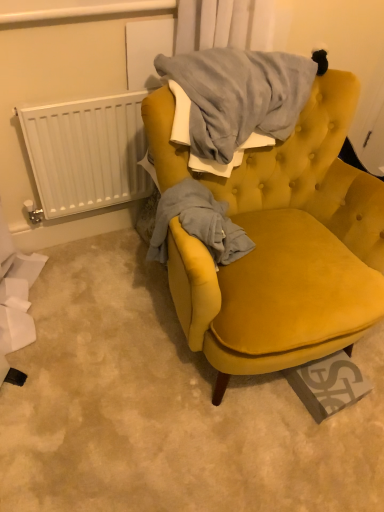
Where is `white plastic radiator at left`? Image resolution: width=384 pixels, height=512 pixels. white plastic radiator at left is located at coordinates (87, 153).

The width and height of the screenshot is (384, 512). What do you see at coordinates (87, 153) in the screenshot?
I see `white plastic radiator at left` at bounding box center [87, 153].

Measure the distance between white plastic radiator at left and camera.

white plastic radiator at left is 1.24 meters away from camera.

At what (x,y) coordinates should I click in order to perform the action: click on velvet yellow armchair at center. Please return your answer as a coordinate pair (x, y). This screenshot has width=384, height=512. Looking at the image, I should click on (288, 250).

Describe the element at coordinates (288, 250) in the screenshot. I see `velvet yellow armchair at center` at that location.

Locate an element on the screen. This screenshot has height=512, width=384. white plastic radiator at left is located at coordinates (87, 153).

From the picture: Is velvet yellow armchair at center at the right side of white plastic radiator at left?

Yes, velvet yellow armchair at center is to the right of white plastic radiator at left.

In the image, is velvet yellow armchair at center positioned in front of or behind white plastic radiator at left?

Clearly, velvet yellow armchair at center is in front of white plastic radiator at left.

Considering the positions of point (321, 241) and point (113, 154), is point (321, 241) closer or farther from the camera than point (113, 154)?

Point (321, 241) is positioned closer to the camera compared to point (113, 154).

From the image's perspective, is velvet yellow armchair at center on white plastic radiator at left?

No.

From a real-world perspective, is velvet yellow armchair at center above or below white plastic radiator at left?

In terms of real-world spatial position, velvet yellow armchair at center is below white plastic radiator at left.

Considering the sizes of velvet yellow armchair at center and white plastic radiator at left in the image, is velvet yellow armchair at center wider or thinner than white plastic radiator at left?

Clearly, velvet yellow armchair at center has more width compared to white plastic radiator at left.

Considering the sizes of velvet yellow armchair at center and white plastic radiator at left in the image, is velvet yellow armchair at center taller or shorter than white plastic radiator at left?

velvet yellow armchair at center is taller than white plastic radiator at left.

Is velvet yellow armchair at center bigger than white plastic radiator at left?

Yes.

Is velvet yellow armchair at center surrounding white plastic radiator at left?

No, white plastic radiator at left is located outside of velvet yellow armchair at center.

Is velvet yellow armchair at center next to white plastic radiator at left?

No, velvet yellow armchair at center is not with white plastic radiator at left.

Is velvet yellow armchair at center facing towards white plastic radiator at left?

No, velvet yellow armchair at center is not oriented towards white plastic radiator at left.

How much distance is there between velvet yellow armchair at center and white plastic radiator at left?

They are 21.08 inches apart.

Locate an element on the screen. This screenshot has height=512, width=384. chair beneath the white plastic radiator at left (from a real-world perspective) is located at coordinates [x=288, y=250].

Is white plastic radiator at left to the left or to the right of velvet yellow armchair at center in the image?

white plastic radiator at left is to the left of velvet yellow armchair at center.

Relative to velvet yellow armchair at center, is white plastic radiator at left in front or behind?

In the image, white plastic radiator at left appears behind velvet yellow armchair at center.

Does point (42, 156) come farther from viewer compared to point (271, 177)?

No.

From the image's perspective, is white plastic radiator at left over velvet yellow armchair at center?

Indeed, from the image's perspective, white plastic radiator at left is shown above velvet yellow armchair at center.

From a real-world perspective, is white plastic radiator at left on velvet yellow armchair at center?

Yes, from a real-world perspective, white plastic radiator at left is over velvet yellow armchair at center

Considering the sizes of objects white plastic radiator at left and velvet yellow armchair at center in the image provided, who is wider, white plastic radiator at left or velvet yellow armchair at center?

Wider between the two is velvet yellow armchair at center.

Does white plastic radiator at left have a lesser height compared to velvet yellow armchair at center?

Indeed, white plastic radiator at left has a lesser height compared to velvet yellow armchair at center.

Considering the sizes of objects white plastic radiator at left and velvet yellow armchair at center in the image provided, who is smaller, white plastic radiator at left or velvet yellow armchair at center?

Smaller between the two is white plastic radiator at left.

Choose the correct answer: Is white plastic radiator at left inside velvet yellow armchair at center or outside it?

white plastic radiator at left is located beyond the bounds of velvet yellow armchair at center.

Is white plastic radiator at left next to velvet yellow armchair at center?

No, white plastic radiator at left is not touching velvet yellow armchair at center.

Is white plastic radiator at left aimed at velvet yellow armchair at center?

Yes, white plastic radiator at left faces towards velvet yellow armchair at center.

How far apart are white plastic radiator at left and velvet yellow armchair at center?

white plastic radiator at left is 21.08 inches from velvet yellow armchair at center.

This screenshot has width=384, height=512. In order to click on radiator that is on the left side of velvet yellow armchair at center in this screenshot , I will do `click(87, 153)`.

I want to click on chair on the right of white plastic radiator at left, so click(288, 250).

At what (x,y) coordinates should I click in order to perform the action: click on chair in front of the white plastic radiator at left. Please return your answer as a coordinate pair (x, y). Image resolution: width=384 pixels, height=512 pixels. Looking at the image, I should click on (288, 250).